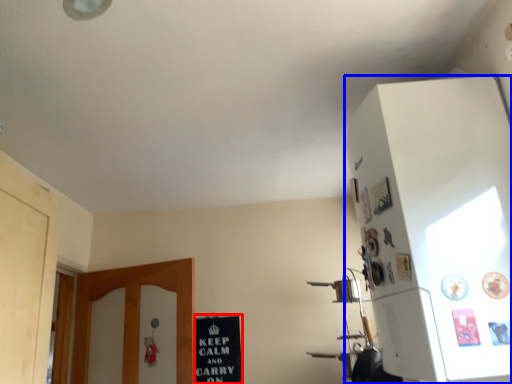
Question: Which point is closer to the camera, bulletin board (highlighted by a red box) or cabinetry (highlighted by a blue box)?

Choices:
 (A) bulletin board
 (B) cabinetry

Answer: (B)